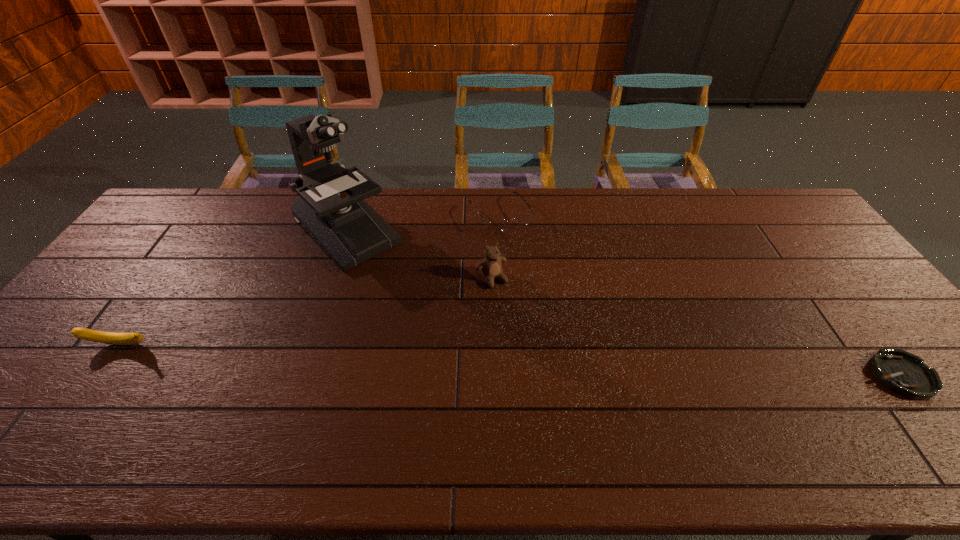
Find the location of a particular element. The width and height of the screenshot is (960, 540). free space on the desktop that is between the leftmost object and the rightmost object and is positioned through the eyepieces of the second object from left to right is located at coordinates (481, 359).

The image size is (960, 540). In order to click on vacant space on the desktop that is between the banana and the shortest object and is positioned on the front-facing side of the fourth shortest object in this screenshot , I will do `click(547, 362)`.

You are a GUI agent. You are given a task and a screenshot of the screen. Output one action in this format:
    pyautogui.click(x=<x>, y=<y>)
    Task: Click on the free space on the desktop that is between the banana and the shortest object and is positioned on the front-facing side of the second shortest object
    
    Given the screenshot: What is the action you would take?
    pyautogui.click(x=594, y=363)